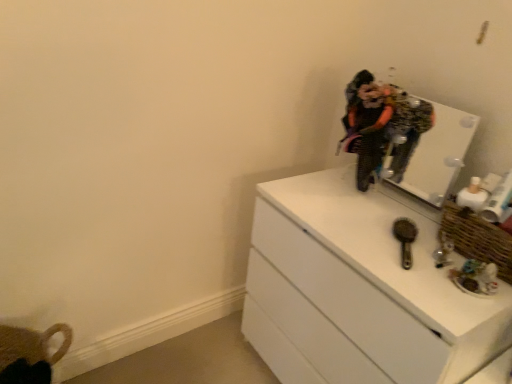
Question: Is point (288, 322) closer or farther from the camera than point (440, 127)?

Choices:
 (A) farther
 (B) closer

Answer: (A)

Question: From the image's perspective, relative to white glossy mirror at upper right, is white glossy chest of drawers at right above or below?

Choices:
 (A) above
 (B) below

Answer: (B)

Question: Which object is positioned farthest from the textured black dress at center?

Choices:
 (A) woven brown basket at right
 (B) white glossy chest of drawers at right
 (C) white glossy mirror at upper right
 (D) metallic brown brush at center-right

Answer: (A)

Question: Which of these objects is positioned farthest from the woven brown basket at right?

Choices:
 (A) white glossy mirror at upper right
 (B) white glossy chest of drawers at right
 (C) metallic brown brush at center-right
 (D) textured black dress at center

Answer: (A)